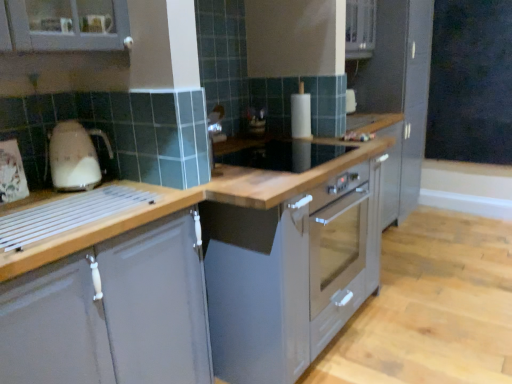
Question: From a real-world perspective, is matte gray cabinet at left, placed as the first cabinetry when sorted from front to back, physically above satin grey cabinet at right, positioned as the 2th cabinetry in bottom-to-top order?

Choices:
 (A) no
 (B) yes

Answer: (A)

Question: Does matte gray cabinet at left, positioned as the second cabinetry in top-to-bottom order, have a lesser height compared to satin grey cabinet at right, which appears as the 1th cabinetry when viewed from the right?

Choices:
 (A) yes
 (B) no

Answer: (A)

Question: Can you confirm if matte gray cabinet at left, placed as the first cabinetry when sorted from front to back, is bigger than satin grey cabinet at right, the 1th cabinetry in the top-to-bottom sequence?

Choices:
 (A) no
 (B) yes

Answer: (A)

Question: Is matte gray cabinet at left, which ranks as the second cabinetry in right-to-left order, taller than satin grey cabinet at right, which is the 2th cabinetry from left to right?

Choices:
 (A) no
 (B) yes

Answer: (A)

Question: Is matte gray cabinet at left, the first cabinetry when ordered from bottom to top, wider than satin grey cabinet at right, the 1th cabinetry in the top-to-bottom sequence?

Choices:
 (A) no
 (B) yes

Answer: (A)

Question: Is point (130, 372) positioned closer to the camera than point (285, 349)?

Choices:
 (A) farther
 (B) closer

Answer: (B)

Question: Considering their positions, is matte gray cabinet at left, positioned as the second cabinetry in back-to-front order, located in front of or behind satin silver oven at center?

Choices:
 (A) behind
 (B) front

Answer: (B)

Question: Visually, is matte gray cabinet at left, positioned as the second cabinetry in back-to-front order, positioned to the left or to the right of satin silver oven at center?

Choices:
 (A) left
 (B) right

Answer: (A)

Question: Do you think matte gray cabinet at left, positioned as the second cabinetry in back-to-front order, is within satin silver oven at center, or outside of it?

Choices:
 (A) inside
 (B) outside

Answer: (B)

Question: Do you think satin grey cabinet at right, which is the 2th cabinetry from left to right, is within matte gray cabinet at left, which ranks as the second cabinetry in right-to-left order, or outside of it?

Choices:
 (A) inside
 (B) outside

Answer: (B)

Question: From the image's perspective, relative to matte gray cabinet at left, the first cabinetry when ordered from bottom to top, is satin grey cabinet at right, arranged as the 1th cabinetry when viewed from the back, above or below?

Choices:
 (A) above
 (B) below

Answer: (A)

Question: Considering the positions of satin grey cabinet at right, the 2th cabinetry in the front-to-back sequence, and matte gray cabinet at left, positioned as the second cabinetry in back-to-front order, in the image, is satin grey cabinet at right, the 2th cabinetry in the front-to-back sequence, wider or thinner than matte gray cabinet at left, positioned as the second cabinetry in back-to-front order,?

Choices:
 (A) thin
 (B) wide

Answer: (B)

Question: From a real-world perspective, is satin grey cabinet at right, the 1th cabinetry in the top-to-bottom sequence, physically located above or below matte gray cabinet at left, placed as the first cabinetry when sorted from front to back?

Choices:
 (A) below
 (B) above

Answer: (B)

Question: Is satin grey cabinet at right, the 2th cabinetry in the front-to-back sequence, in front of or behind black matte chalkboard at upper right in the image?

Choices:
 (A) front
 (B) behind

Answer: (A)

Question: Is satin grey cabinet at right, which appears as the 1th cabinetry when viewed from the right, to the left or to the right of black matte chalkboard at upper right in the image?

Choices:
 (A) left
 (B) right

Answer: (A)